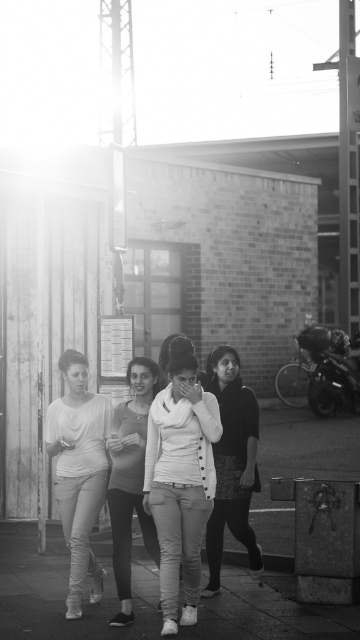
Is white cotton sweater at center to the left of white textured sweater at center from the viewer's perspective?

Yes, white cotton sweater at center is to the left of white textured sweater at center.

Does white cotton sweater at center have a smaller size compared to white textured sweater at center?

Incorrect, white cotton sweater at center is not smaller in size than white textured sweater at center.

You are a GUI agent. You are given a task and a screenshot of the screen. Output one action in this format:
    pyautogui.click(x=<x>, y=<y>)
    Task: Click on the white cotton sweater at center
    This screenshot has height=640, width=360.
    Given the screenshot: What is the action you would take?
    click(x=181, y=480)

Can you confirm if matte white blouse at center is positioned below matte white sweater at center?

No, matte white blouse at center is not below matte white sweater at center.

Measure the distance from matte white blouse at center to matte white sweater at center.

A distance of 14.47 inches exists between matte white blouse at center and matte white sweater at center.

Is point (108, 419) positioned before point (117, 412)?

No, it is not.

Where is `matte white blouse at center`? matte white blouse at center is located at coordinates (78, 472).

Looking at this image, between white cotton sweater at center and matte white sweater at center, which one has more height?

white cotton sweater at center

Image resolution: width=360 pixels, height=640 pixels. What do you see at coordinates (181, 480) in the screenshot?
I see `white cotton sweater at center` at bounding box center [181, 480].

This screenshot has width=360, height=640. I want to click on white cotton sweater at center, so click(181, 480).